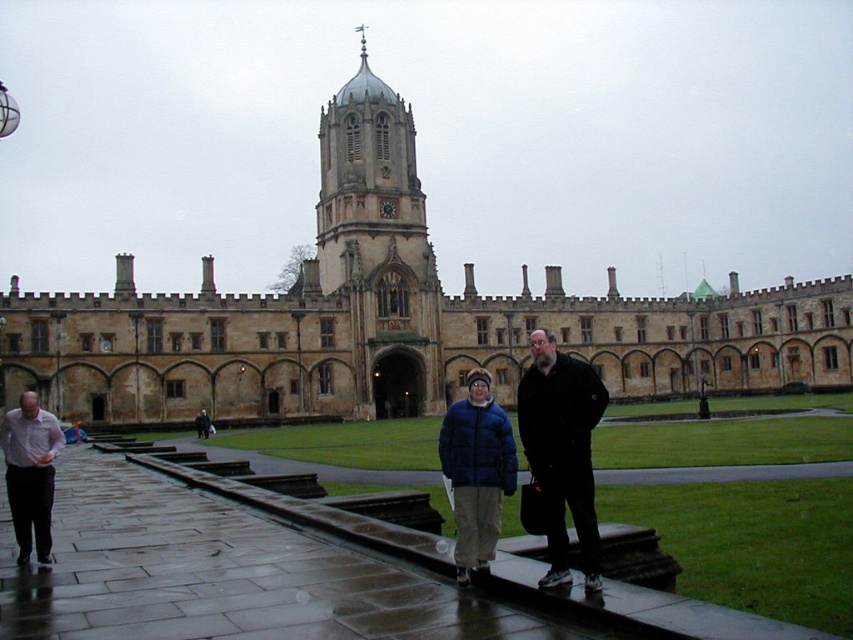
You are a photographer trying to capture the brown stone church at center and the matte blue puffer jacket at center in a single shot. Based on their positions, which object should you focus on first to ensure both are in frame?

The brown stone church at center is above the matte blue puffer jacket at center, so you should focus on the matte blue puffer jacket at center first to ensure both are in frame.